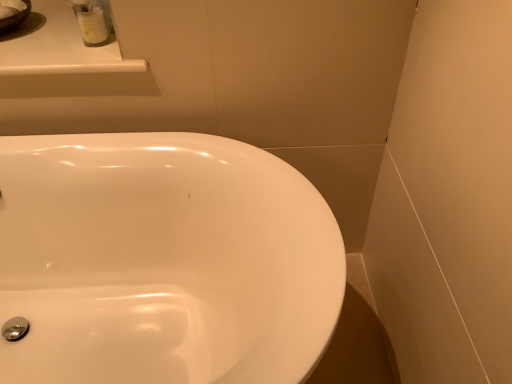
I want to click on vacant space in front of white glossy container at upper left, so click(x=83, y=62).